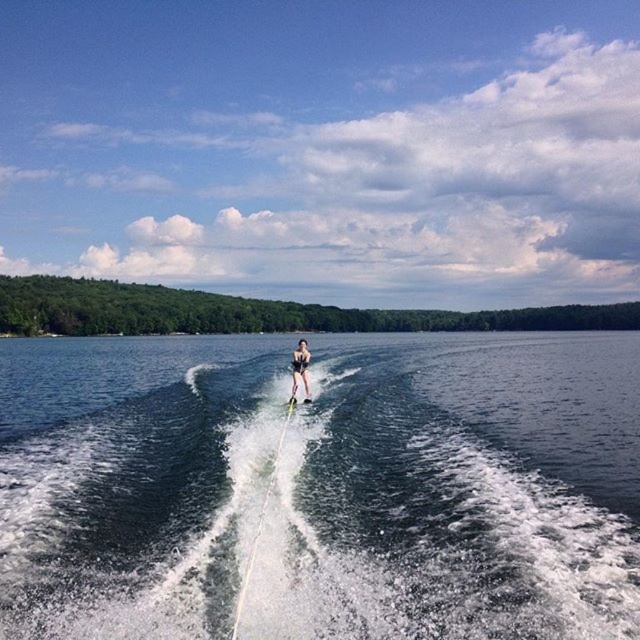
You are a photographer trying to capture the skier in the image. Since the clear blue water at center and the black swimsuit at center are both in focus, which one would you say occupies more visual space in the photo?

The clear blue water at center has a larger size compared to the black swimsuit at center, so it occupies more visual space in the photo.

You are a photographer trying to capture the perfect shot of the water skier. You notice the clear blue water at center and the black swimsuit at center. Which object is taller in the image?

The black swimsuit at center is taller than the clear blue water at center.

You are a photographer trying to capture the skier in the image. Since the clear blue water at center and the black swimsuit at center are both at the center, which one is closer to the camera?

The clear blue water at center is in front of the black swimsuit at center, so the clear blue water at center is closer to the camera.